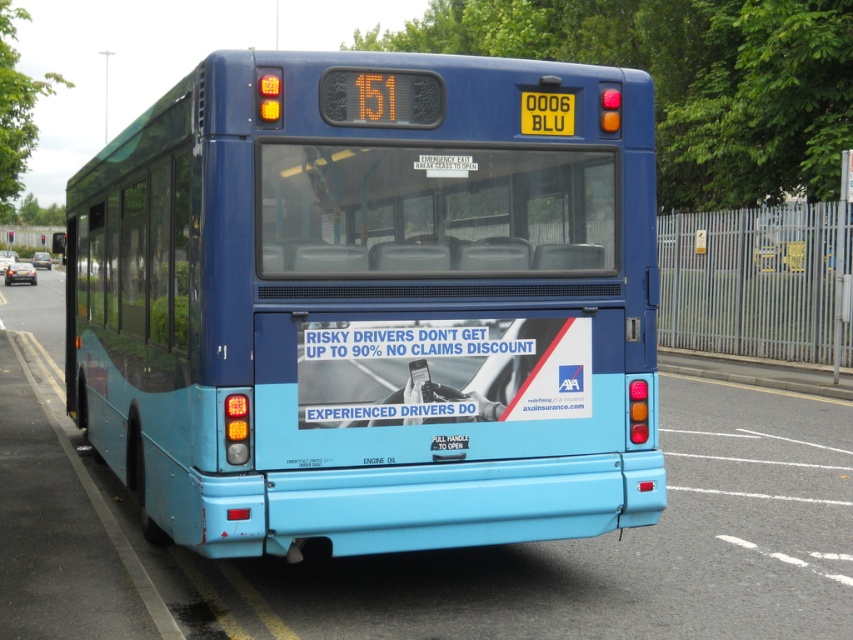
You are a photographer trying to capture the rear of the blue bus. You notice two points marked on the bus at coordinates point (x=74, y=280) and point (x=550, y=122). If you want to focus on the point closer to you, which coordinate should you aim your camera at?

You should focus on point (x=74, y=280) because it is closer to you compared to point (x=550, y=122).

You are a city planner analyzing traffic patterns. You need to determine the position of the matte blue bus at center in the image. What are its coordinates?

The matte blue bus at center is located at coordinates point (370, 305).

What is the relationship between the height of the matte blue bus at center and the yellow plastic license plate at center?

The matte blue bus at center has a greater height compared to the yellow plastic license plate at center.